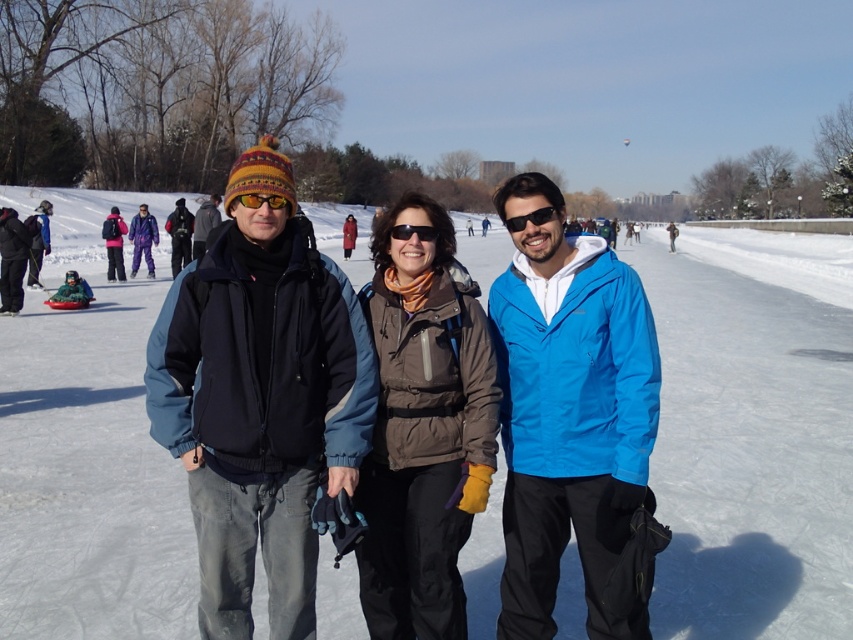
You are at the ice skating rink and want to move from your current position to the point marked by point (x=218, y=220). There is an obstacle at point (x=4, y=296). Will you need to go around it?

Yes, you will need to go around the obstacle at point (x=4, y=296) because it is in front of your path to point (x=218, y=220).

You are standing at the edge of the ice rink and see the dark gray jacket at center and the black plastic sunglasses at center. Which object is positioned to the left when viewed from your perspective?

The dark gray jacket at center is to the left of the black plastic sunglasses at center.